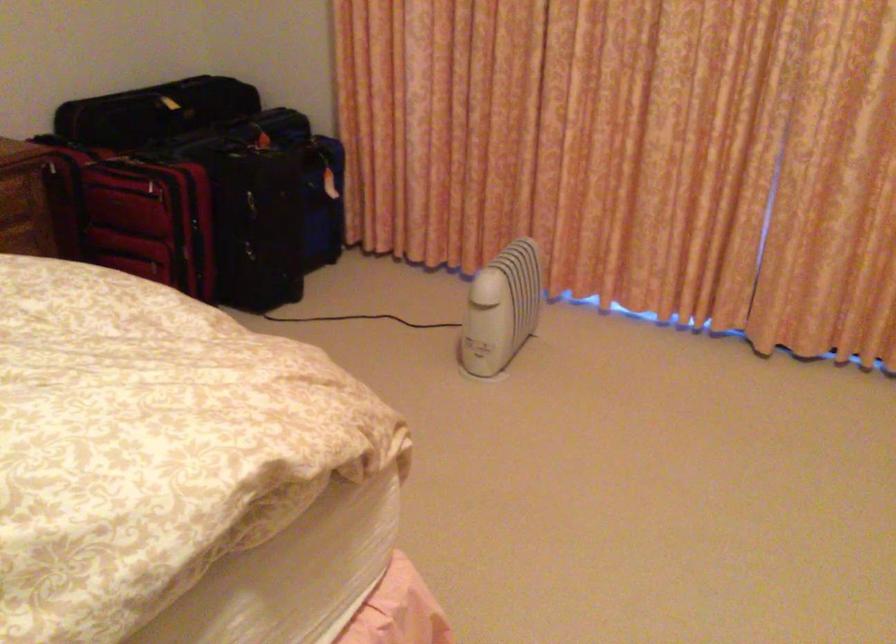
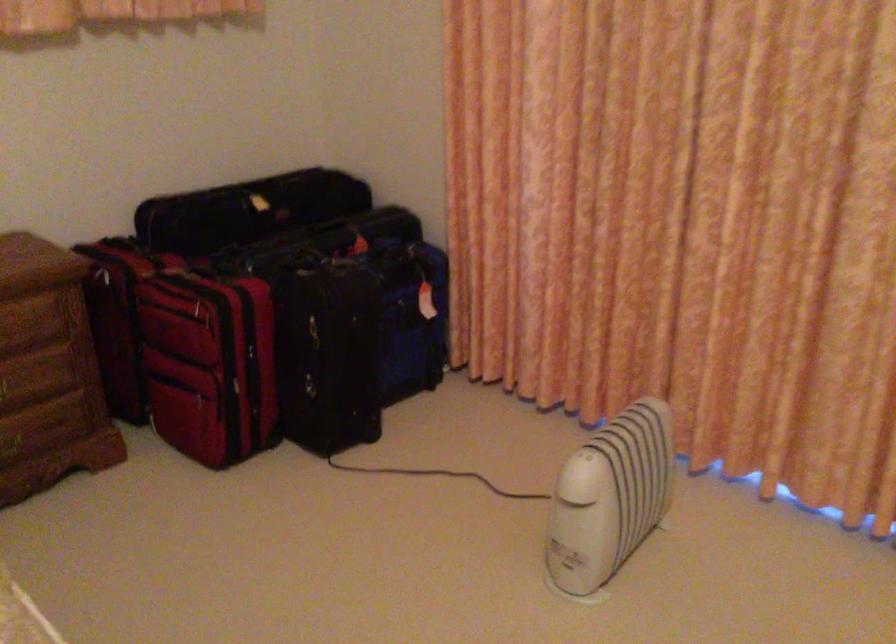
Where in the second image is the point corresponding to the point at 185,178 from the first image?

(243, 292)